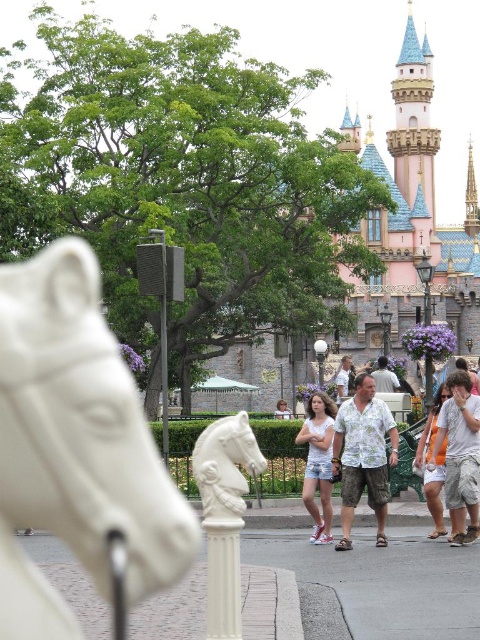
Is white cotton shirt at center smaller than light brown hair at center?

No, white cotton shirt at center is not smaller than light brown hair at center.

Does white cotton shirt at center have a greater height compared to light brown hair at center?

Correct, white cotton shirt at center is much taller as light brown hair at center.

Where is `white cotton shirt at center`? The image size is (480, 640). white cotton shirt at center is located at coordinates (460, 454).

Which of these two, white cotton shirt at center or white cotton tank top at center, stands shorter?

white cotton tank top at center

Is white cotton shirt at center taller than white cotton tank top at center?

Yes.

I want to click on white cotton shirt at center, so click(460, 454).

Who is higher up, white marble horse at center or white cotton shorts at lower right?

white marble horse at center is above.

Is point (98, 465) positioned before point (452, 524)?

Yes, it is.

Who is more distant from viewer, (14, 374) or (437, 400)?

Point (437, 400)

The height and width of the screenshot is (640, 480). I want to click on white marble horse at center, so click(75, 445).